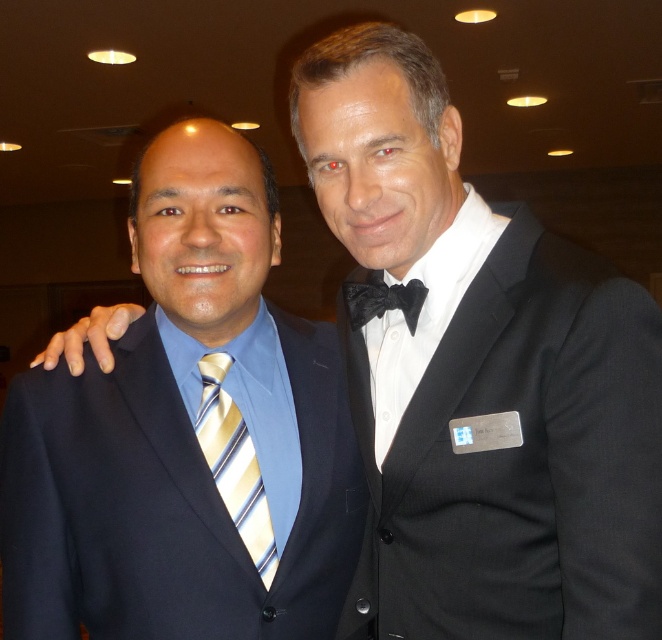
You are a photographer at the event and need to capture a closeup of both the black satin bow tie at right and the yellow striped tie at left. Since your camera can only focus on one object at a time, which tie should you adjust your focus to first if you want to ensure the closest one is in focus?

The yellow striped tie at left is closer to you than the black satin bow tie at right, so you should focus on the yellow striped tie at left first.